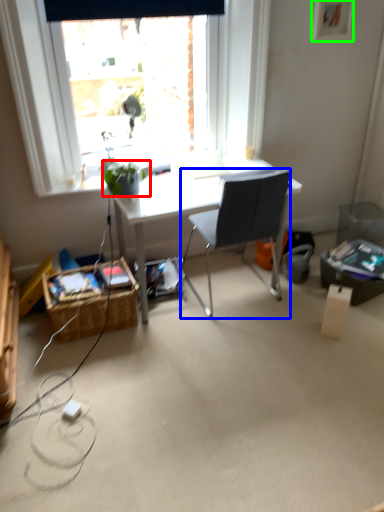
Question: Which object is the closest to the houseplant (highlighted by a red box)? Choose among these: chair (highlighted by a blue box) or picture frame (highlighted by a green box).

Choices:
 (A) chair
 (B) picture frame

Answer: (A)